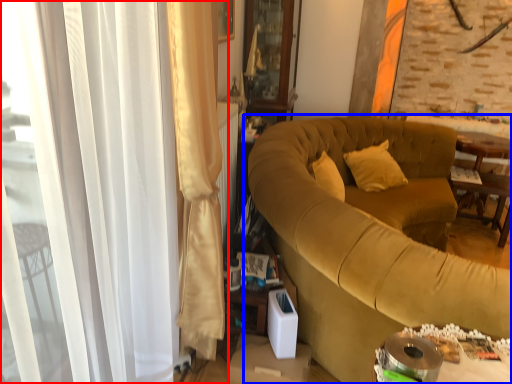
Question: Which point is further to the camera, curtain (highlighted by a red box) or studio couch (highlighted by a blue box)?

Choices:
 (A) curtain
 (B) studio couch

Answer: (B)